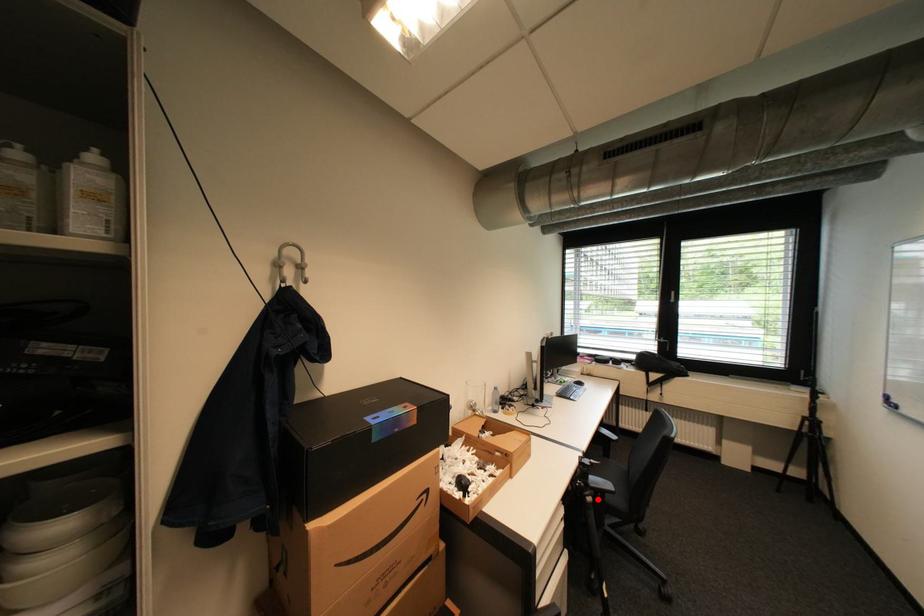
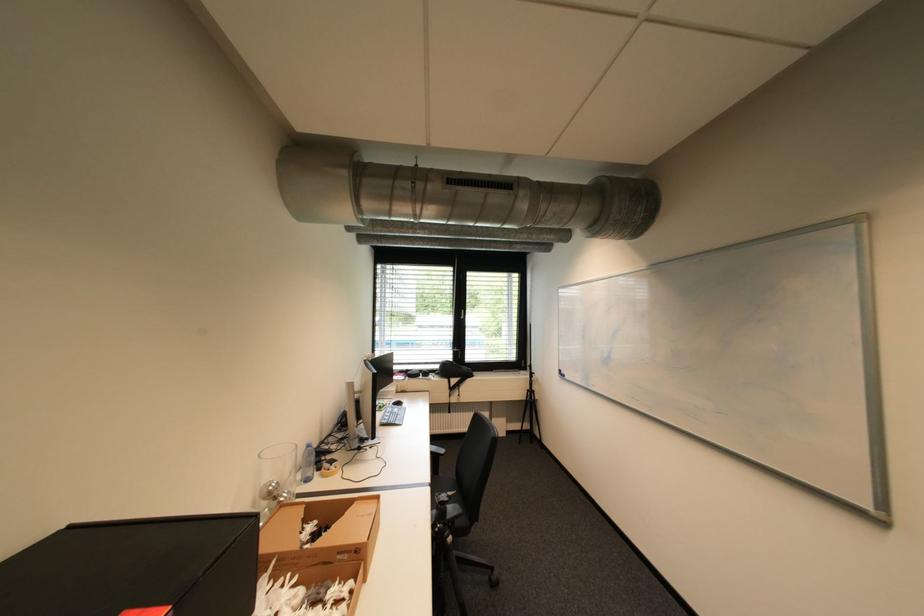
Find the pixel in the second image that matches the highlighted location in the first image.

(458, 540)